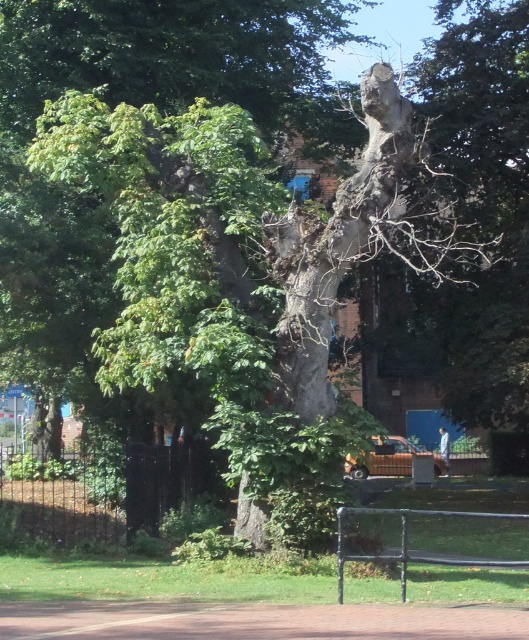
You are standing in front of a tree with a thick trunk and a brick building with a blue door in the background. There is a parked orange vehicle nearby. If you were to walk directly towards the smooth gray tree trunk at center, which is represented by the point at coordinates (174,54), would you first encounter the brick building with a blue door or the parked orange vehicle?

The smooth gray tree trunk at center is represented by point (174,54). Since the brick building with a blue door is partially obscured by the tree and the parked orange vehicle is visible in the background, the parked orange vehicle is farther away. Therefore, walking towards the tree trunk, you would first encounter the brick building with a blue door before reaching the parked orange vehicle.

You are a visitor in the park and want to sit on the black metal park bench at lower center. Can you see the blue door of the brick building through the smooth gray tree trunk at center when sitting there?

The black metal park bench at lower center is behind the smooth gray tree trunk at center, so when sitting on the bench, the tree trunk would block your view of the blue door of the brick building.

You are a gardener planning to place a new black metal park bench at lower center next to the smooth gray tree trunk at center. Based on their widths, which object is wider?

The smooth gray tree trunk at center is wider than the black metal park bench at lower center.